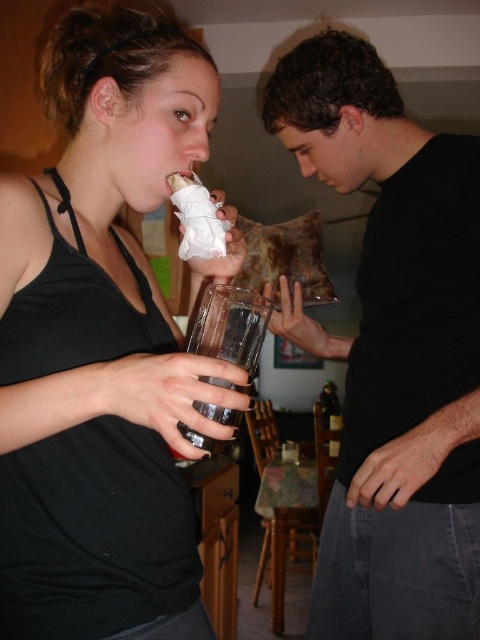
Question: Among these points, which one is nearest to the camera?

Choices:
 (A) (147, 195)
 (B) (288, 80)

Answer: (A)

Question: In this image, where is matte black tank top at center located relative to transparent glass at center?

Choices:
 (A) left
 (B) right

Answer: (A)

Question: Can you confirm if matte black tank top at center is wider than black matte shirt at center?

Choices:
 (A) yes
 (B) no

Answer: (B)

Question: Is black matte shirt at center to the left of transparent glass at center from the viewer's perspective?

Choices:
 (A) no
 (B) yes

Answer: (A)

Question: Which point appears farthest from the camera in this image?

Choices:
 (A) (467, 385)
 (B) (233, 284)
 (C) (34, 609)

Answer: (B)

Question: Which point is farther to the camera?

Choices:
 (A) matte black tank top at center
 (B) black matte shirt at center

Answer: (B)